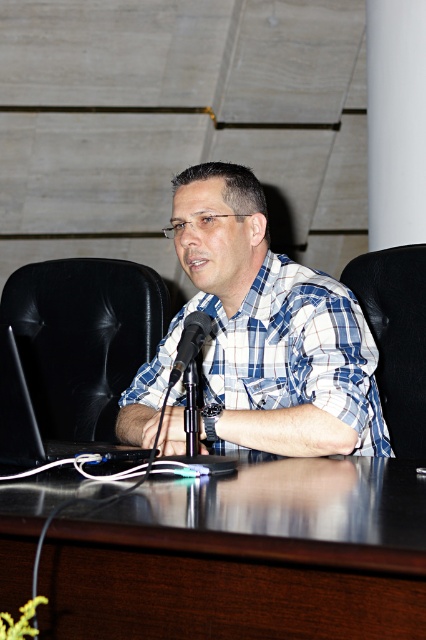
Is dark wood table at center above black leather chair at right?

Actually, dark wood table at center is below black leather chair at right.

Is dark wood table at center behind black leather chair at right?

No, dark wood table at center is closer to the viewer.

Between point (307, 612) and point (380, 250), which one is positioned in front?

Point (307, 612) is more forward.

The width and height of the screenshot is (426, 640). Identify the location of dark wood table at center. (245, 556).

Does point (155, 372) lie behind point (405, 278)?

No, it is not.

Who is more distant from viewer, (230, 252) or (416, 268)?

Positioned behind is point (416, 268).

The height and width of the screenshot is (640, 426). In order to click on blue plaid shirt at center in this screenshot , I will do `click(261, 333)`.

Is the position of black leather chair at right less distant than that of black metallic microphone at center?

No, it is behind black metallic microphone at center.

Is black leather chair at right bigger than black metallic microphone at center?

Yes, black leather chair at right is bigger than black metallic microphone at center.

I want to click on black leather chair at right, so click(397, 337).

The image size is (426, 640). Find the location of `black leather chair at right`. black leather chair at right is located at coordinates (397, 337).